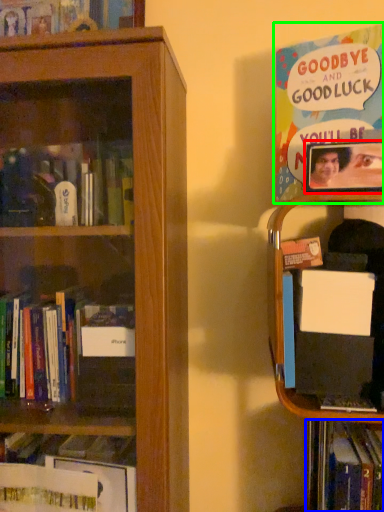
Question: Which object is the farthest from picture frame (highlighted by a red box)? Choose among these: book (highlighted by a blue box) or book (highlighted by a green box).

Choices:
 (A) book
 (B) book

Answer: (A)